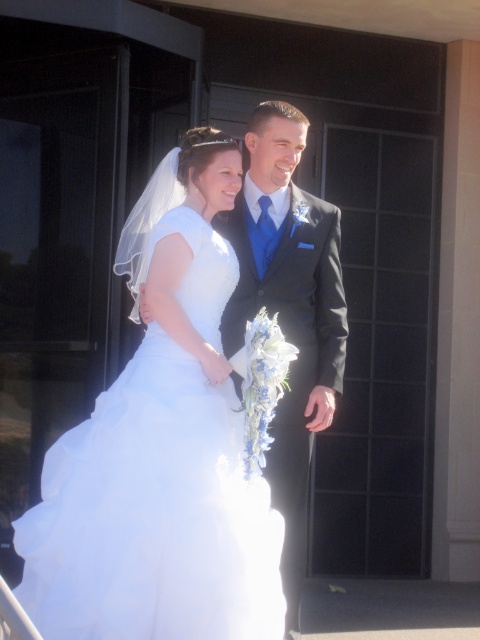
In the scene shown: You are a photographer adjusting your camera settings to focus on two specific points in the wedding scene. The points are labeled as point 1 at coordinates point (x=76, y=566) and point 2 at coordinates point (x=292, y=564). Which point should you focus on first if you want to ensure both points are in sharp focus without moving the camera?

You should focus on point 1 at coordinates point (x=76, y=566) first because it is closer to the camera than point 2 at coordinates point (x=292, y=564). By focusing on the closer point, the farther point will also be within the depth of field, ensuring both are in sharp focus without moving the camera.

You are a photographer setting up for the wedding photoshoot. You need to ensure both the white satin dress at center and the shiny black suit at center are fully visible in the frame. Considering their sizes, which one might require more space in the camera frame?

The white satin dress at center has a larger width than the shiny black suit at center, so it would require more space in the camera frame to ensure it is fully visible.